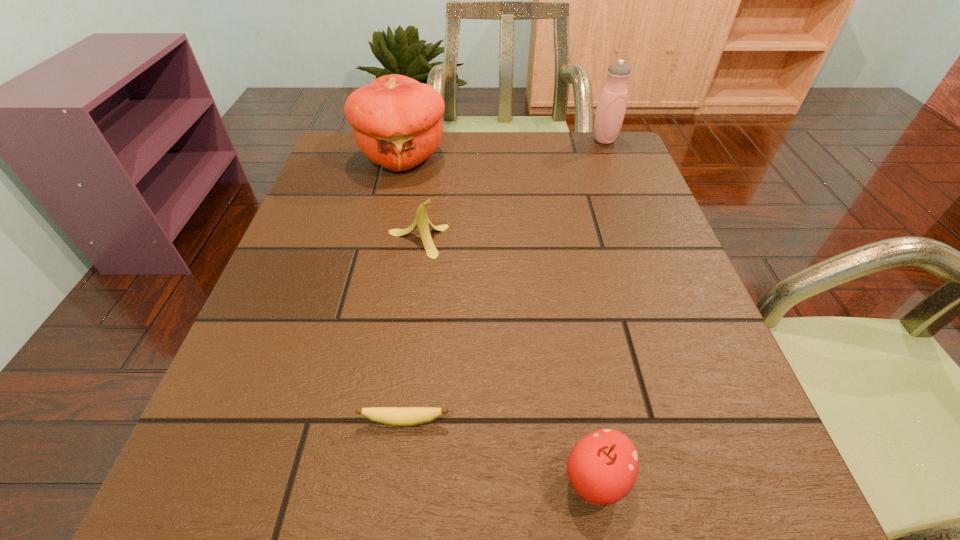
You are a GUI agent. You are given a task and a screenshot of the screen. Output one action in this format:
    pyautogui.click(x=<x>, y=<y>)
    Task: Click on the free space that satisfies the following two spatial constraints: 1. on the back side of the pumpkin; 2. on the right side of the thermos bottle
    This screenshot has height=540, width=960.
    Given the screenshot: What is the action you would take?
    pyautogui.click(x=406, y=140)

Where is `vacant space that satisfies the following two spatial constraints: 1. on the back side of the pumpkin; 2. on the left side of the rightmost object`? vacant space that satisfies the following two spatial constraints: 1. on the back side of the pumpkin; 2. on the left side of the rightmost object is located at coordinates (406, 140).

Identify the location of free location that satisfies the following two spatial constraints: 1. on the front side of the shortest object; 2. on the right side of the pumpkin. The image size is (960, 540). (342, 421).

At what (x,y) coordinates should I click in order to perform the action: click on vacant region that satisfies the following two spatial constraints: 1. on the back side of the farther banana; 2. on the right side of the thermos bottle. Please return your answer as a coordinate pair (x, y). The height and width of the screenshot is (540, 960). Looking at the image, I should click on (433, 140).

Find the location of a particular element. blank space that satisfies the following two spatial constraints: 1. on the back side of the thermos bottle; 2. on the left side of the fourth object from left to right is located at coordinates (537, 140).